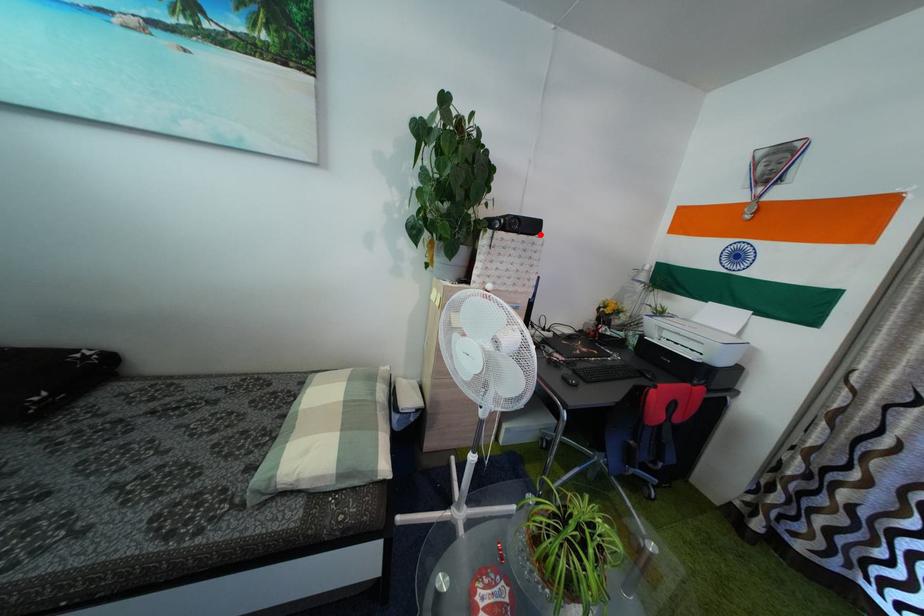
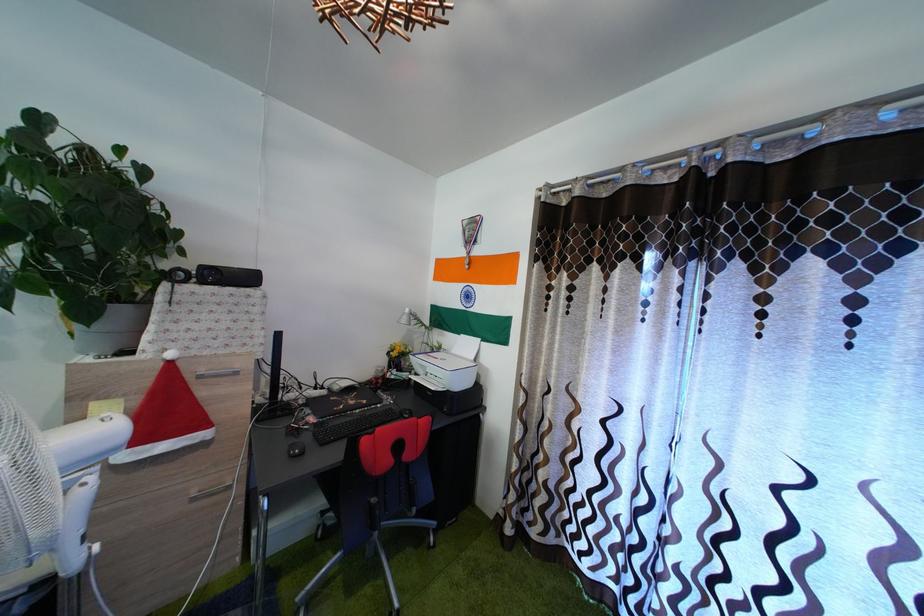
In the second image, find the point that corresponds to the highlighted location in the first image.

(257, 286)